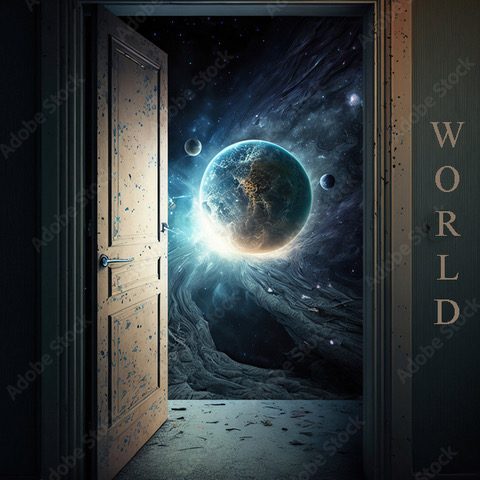
Image resolution: width=480 pixels, height=480 pixels. Identify the location of door frame. (289, 14).